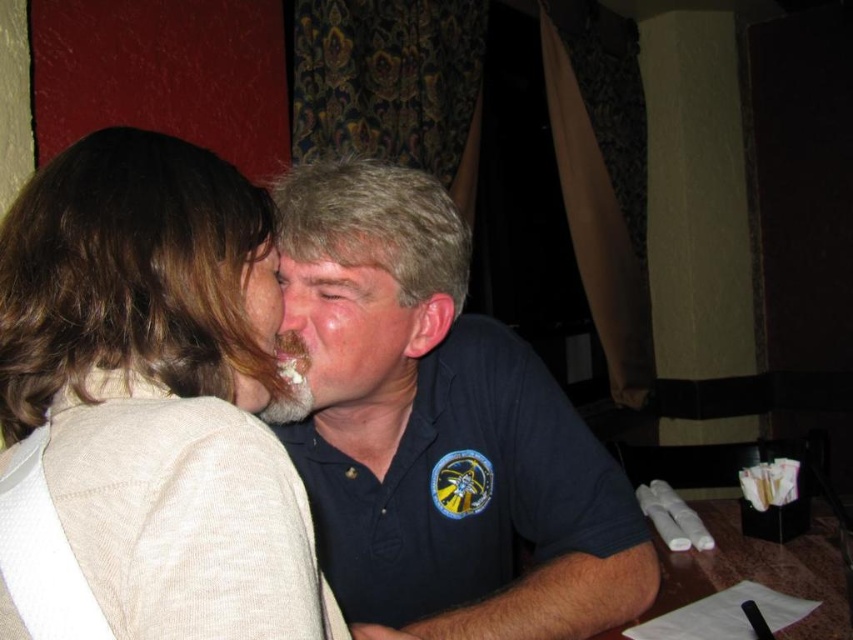
Can you confirm if light beige sweater at upper left is smaller than smooth skin forehead at center?

Incorrect, light beige sweater at upper left is not smaller in size than smooth skin forehead at center.

You are a GUI agent. You are given a task and a screenshot of the screen. Output one action in this format:
    pyautogui.click(x=<x>, y=<y>)
    Task: Click on the light beige sweater at upper left
    The width and height of the screenshot is (853, 640).
    Given the screenshot: What is the action you would take?
    pyautogui.click(x=146, y=406)

Does point (120, 536) come farther from viewer compared to point (256, 256)?

No.

Measure the distance from light beige sweater at upper left to matte skin face at center.

light beige sweater at upper left is 10.35 centimeters away from matte skin face at center.

Is point (170, 449) in front of point (262, 260)?

Yes, point (170, 449) is in front of point (262, 260).

Locate an element on the screen. Image resolution: width=853 pixels, height=640 pixels. light beige sweater at upper left is located at coordinates (146, 406).

Which is below, matte skin face at center or smooth skin forehead at center?

matte skin face at center is lower down.

Does matte skin face at center have a greater width compared to smooth skin forehead at center?

No.

Where is `matte skin face at center`? matte skin face at center is located at coordinates (260, 298).